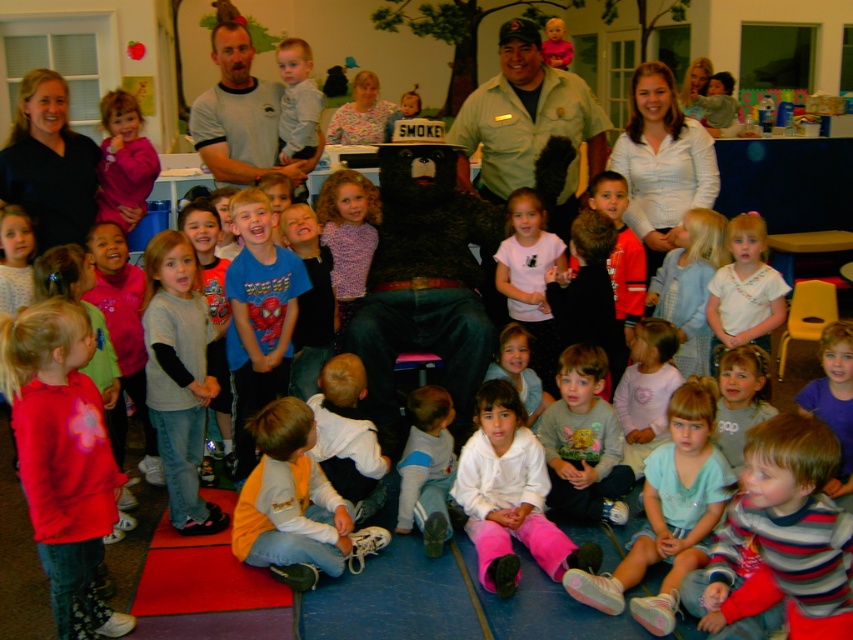
Is matte pink sweatshirt at lower left shorter than orange fleece jacket at lower center?

No, matte pink sweatshirt at lower left is not shorter than orange fleece jacket at lower center.

Can you confirm if matte pink sweatshirt at lower left is positioned below orange fleece jacket at lower center?

Incorrect, matte pink sweatshirt at lower left is not positioned below orange fleece jacket at lower center.

Who is more distant from viewer, [107,460] or [258,412]?

Point [258,412]

Image resolution: width=853 pixels, height=640 pixels. I want to click on matte pink sweatshirt at lower left, so click(62, 458).

Does matte pink sweatshirt at lower left have a smaller size compared to light blue fleece pants at lower center?

No.

Between point (76, 589) and point (436, 518), which one is positioned in front?

Point (76, 589)

What do you see at coordinates (62, 458) in the screenshot? Image resolution: width=853 pixels, height=640 pixels. I see `matte pink sweatshirt at lower left` at bounding box center [62, 458].

The image size is (853, 640). I want to click on matte pink sweatshirt at lower left, so click(x=62, y=458).

Does point (531, 532) come farther from viewer compared to point (242, 170)?

No, (531, 532) is closer to viewer.

What do you see at coordinates (509, 496) in the screenshot? This screenshot has width=853, height=640. I see `white fleece jacket at lower center` at bounding box center [509, 496].

Where is `white fleece jacket at lower center`? This screenshot has width=853, height=640. white fleece jacket at lower center is located at coordinates (509, 496).